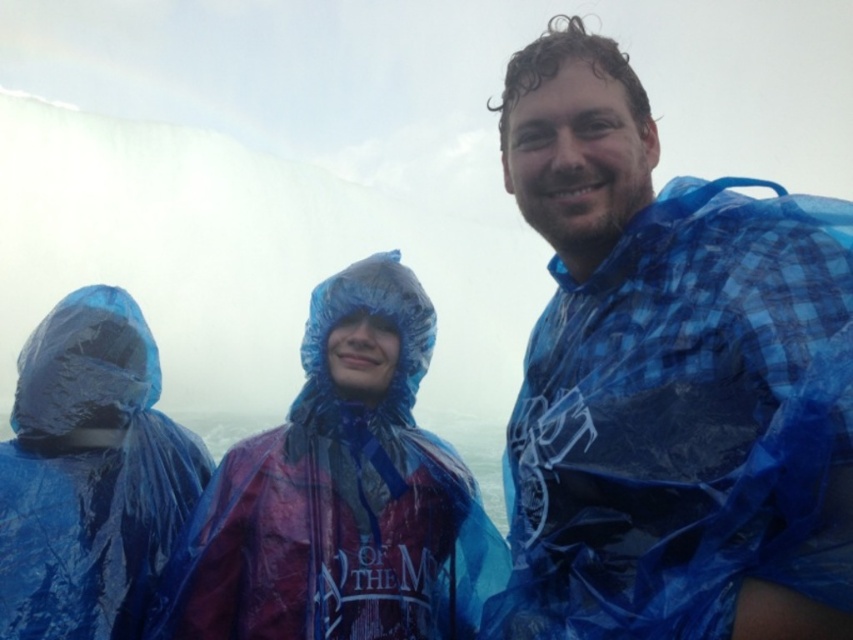
You are a photographer trying to capture a clear shot of the transparent plastic raincoat at center. Since the blue plastic raincoat at center is blocking your view, can you move to the left to get a better angle? Please explain based on their positions.

The blue plastic raincoat at center is located above the transparent plastic raincoat at center. Moving to the left might not help since the blue plastic raincoat is above, so adjusting your angle upwards or moving around to the side could be better options.

You are a photographer trying to capture a clear shot of both the blue plastic raincoat at center and the transparent plastic raincoat at center. Since both are at the center, will you need to adjust your camera focus to capture both clearly in the same photo?

The blue plastic raincoat at center is closer to the viewer than the transparent plastic raincoat at center. To capture both clearly in the same photo, you need to adjust the camera focus to ensure both are within the depth of field.

You are a photographer who wants to ensure that both the blue plastic raincoat at center and the blue plastic raincoat at left are clearly visible in your photo. Given that the raincoat at center is larger, which one might you need to adjust your camera focus on to ensure clarity?

The blue plastic raincoat at left might need more focus adjustment since it is smaller and could be harder to capture clearly compared to the larger one at center.